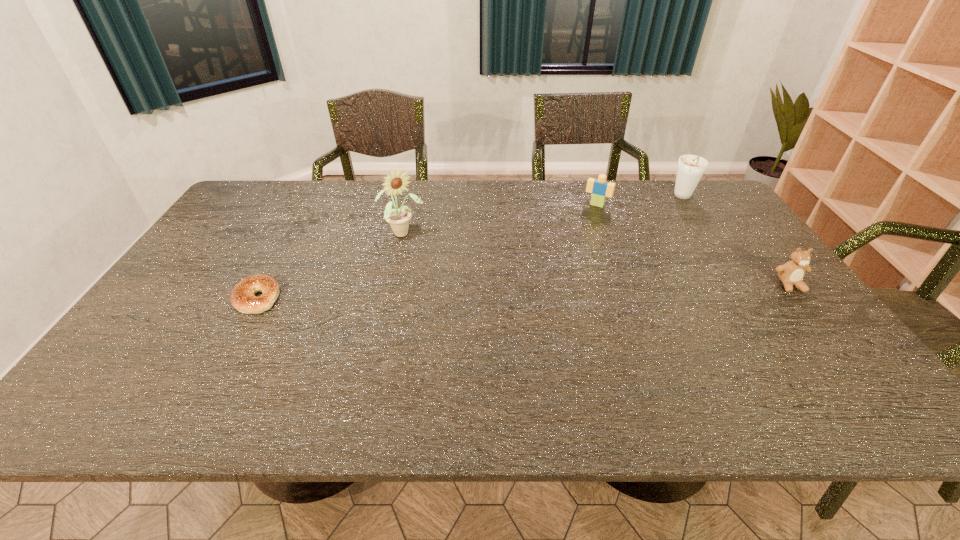
Where is `the leftmost object`? This screenshot has height=540, width=960. the leftmost object is located at coordinates (242, 296).

Image resolution: width=960 pixels, height=540 pixels. In order to click on the shortest object in this screenshot , I will do `click(242, 296)`.

Where is `the rightmost object`? the rightmost object is located at coordinates (791, 274).

I want to click on the third object from left to right, so click(600, 188).

Where is `the fourth shortest object`? the fourth shortest object is located at coordinates point(691,168).

Find the location of a particular element. the fourth object from left to right is located at coordinates (691, 168).

Locate an element on the screen. the tallest object is located at coordinates (398, 219).

Where is `sunflower`? The width and height of the screenshot is (960, 540). sunflower is located at coordinates (398, 219).

The width and height of the screenshot is (960, 540). I want to click on vacant area situated 0.060m on the front of the bagel, so click(x=237, y=333).

In order to click on free region located 0.080m on the front-facing side of the teddy bear in this screenshot , I will do `click(814, 316)`.